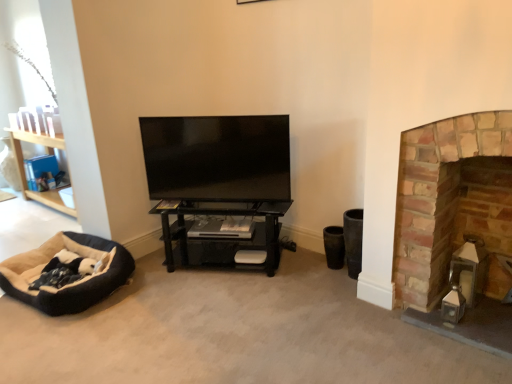
Identify the location of free area below flat screen tv at center (from a real-world perspective). (227, 201).